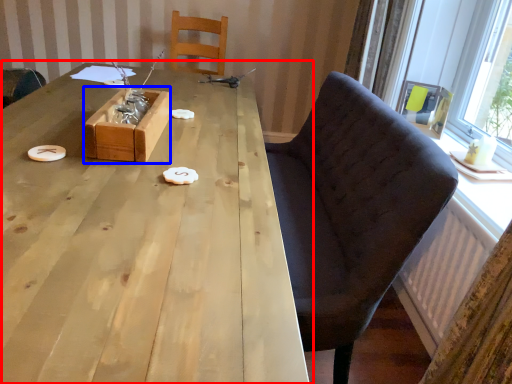
Question: Which object is further to the camera taking this photo, table (highlighted by a red box) or box (highlighted by a blue box)?

Choices:
 (A) table
 (B) box

Answer: (B)